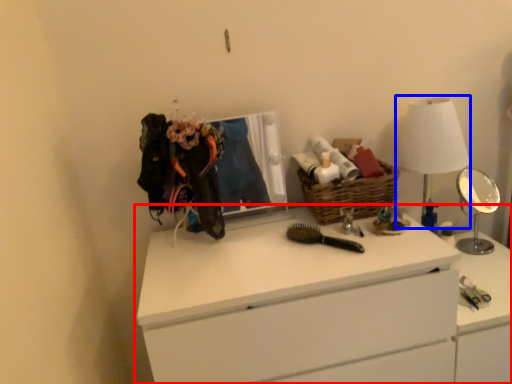
Question: Which point is closer to the camera, chest of drawers (highlighted by a red box) or table lamp (highlighted by a blue box)?

Choices:
 (A) chest of drawers
 (B) table lamp

Answer: (A)